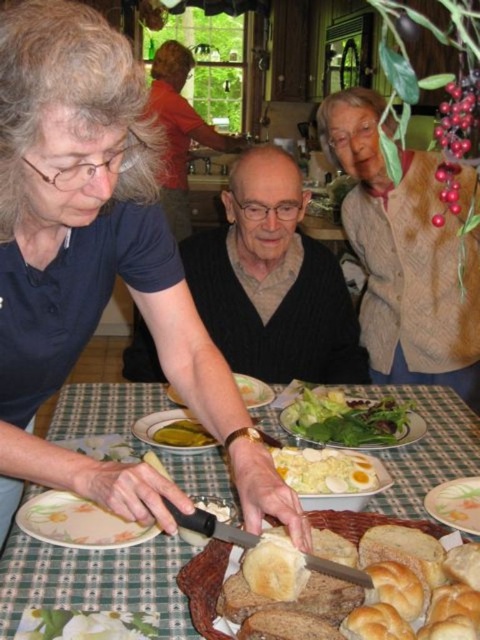
Between yellow creamy spread at center and white glossy plate at center, which one has less height?

With less height is yellow creamy spread at center.

This screenshot has height=640, width=480. What do you see at coordinates (182, 435) in the screenshot?
I see `yellow creamy spread at center` at bounding box center [182, 435].

Is point (192, 429) positioned before point (183, 403)?

No, it is behind (183, 403).

The height and width of the screenshot is (640, 480). In order to click on yellow creamy spread at center in this screenshot , I will do `click(182, 435)`.

Between floral ceramic plate at lower left and white glossy plate at center, which one has more height?

white glossy plate at center is taller.

Does floral ceramic plate at lower left appear over white glossy plate at center?

No, floral ceramic plate at lower left is not above white glossy plate at center.

Between point (73, 506) and point (253, 397), which one is positioned in front?

Point (73, 506) is in front.

The width and height of the screenshot is (480, 640). Find the location of `floral ceramic plate at lower left`. floral ceramic plate at lower left is located at coordinates (78, 522).

Can you confirm if white creamy salad at center is shorter than yellow creamy spread at center?

Incorrect, white creamy salad at center's height does not fall short of yellow creamy spread at center's.

Can you confirm if white creamy salad at center is positioned to the left of yellow creamy spread at center?

No, white creamy salad at center is not to the left of yellow creamy spread at center.

Does point (307, 480) come closer to viewer compared to point (180, 444)?

Yes, it is in front of point (180, 444).

The width and height of the screenshot is (480, 640). In order to click on white creamy salad at center in this screenshot , I will do `click(324, 470)`.